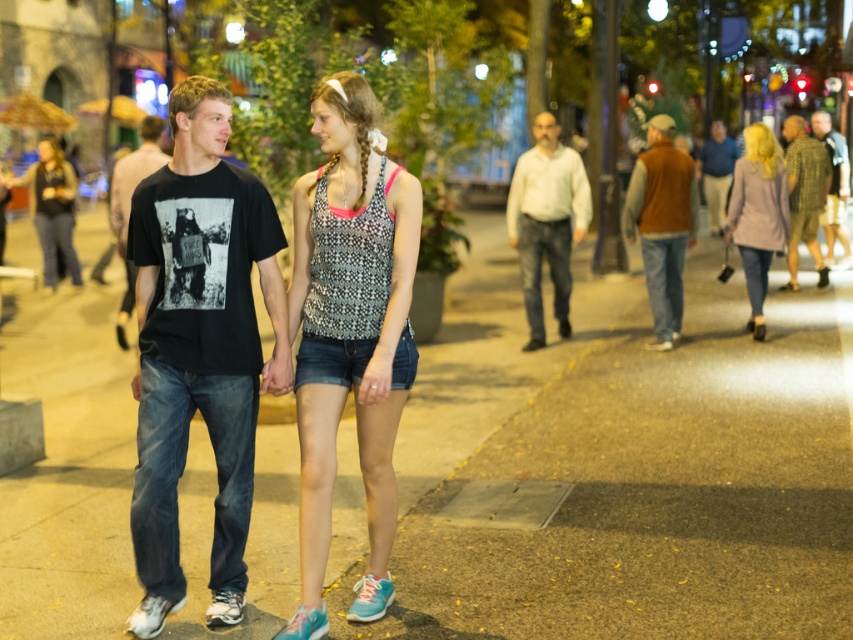
You are a fashion designer observing the urban street scene. You notice the printed fabric tank top at center and the brown suede vest at right. Which clothing item is narrower in width?

The printed fabric tank top at center is narrower in width than the brown suede vest at right.

Looking at this image, you are a fashion blogger who wants to compare the sizes of two jackets in the scene. Which one is smaller between the light gray wool coat at right and the brown leather jacket at right?

The light gray wool coat at right is smaller than the brown leather jacket at right according to the description.

You are a photographer standing on the sidewalk and want to take a photo of both the light gray wool coat at right and the brown leather jacket at right. Which one should you focus on first to ensure both are in the frame?

The light gray wool coat at right is in front of the brown leather jacket at right, so you should focus on the light gray wool coat at right first to ensure both are in the frame.